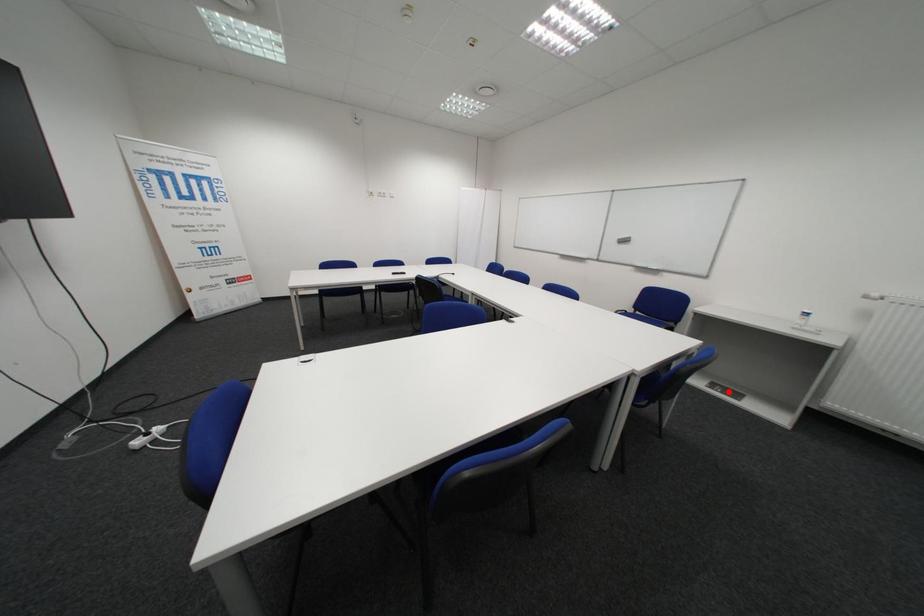
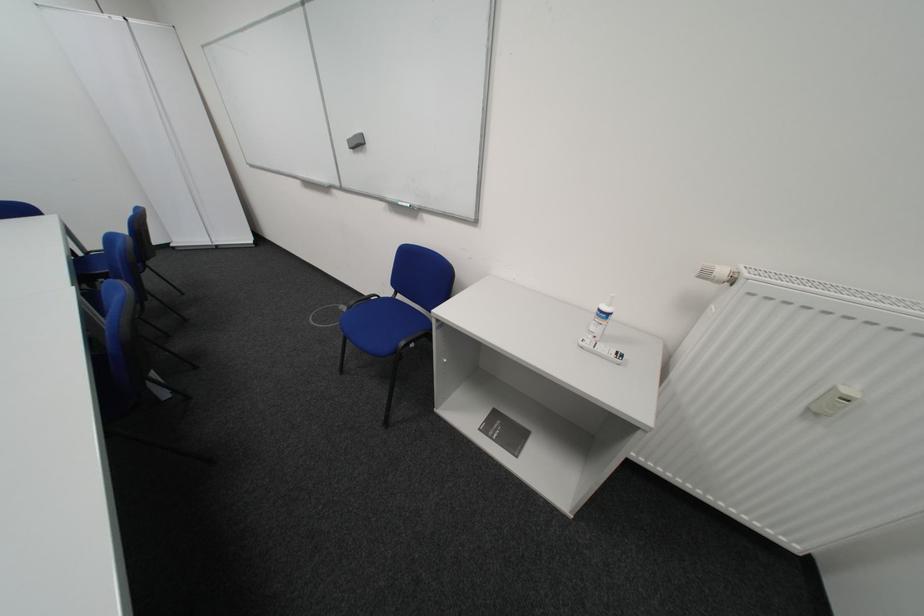
In the second image, find the point that corresponds to the highlighted location in the first image.

(504, 439)